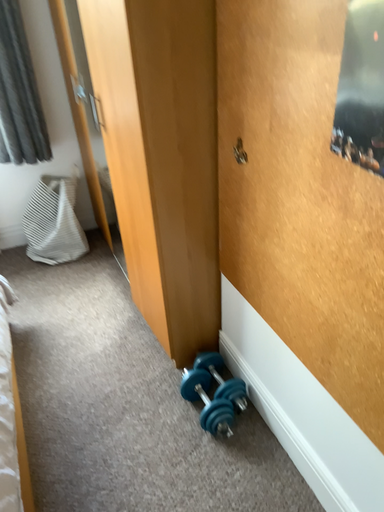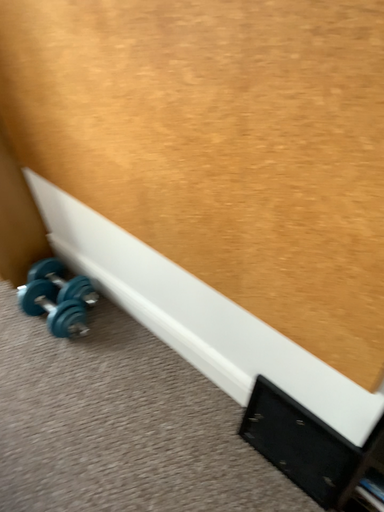
Question: How did the camera likely rotate when shooting the video?

Choices:
 (A) rotated upward
 (B) rotated downward

Answer: (B)